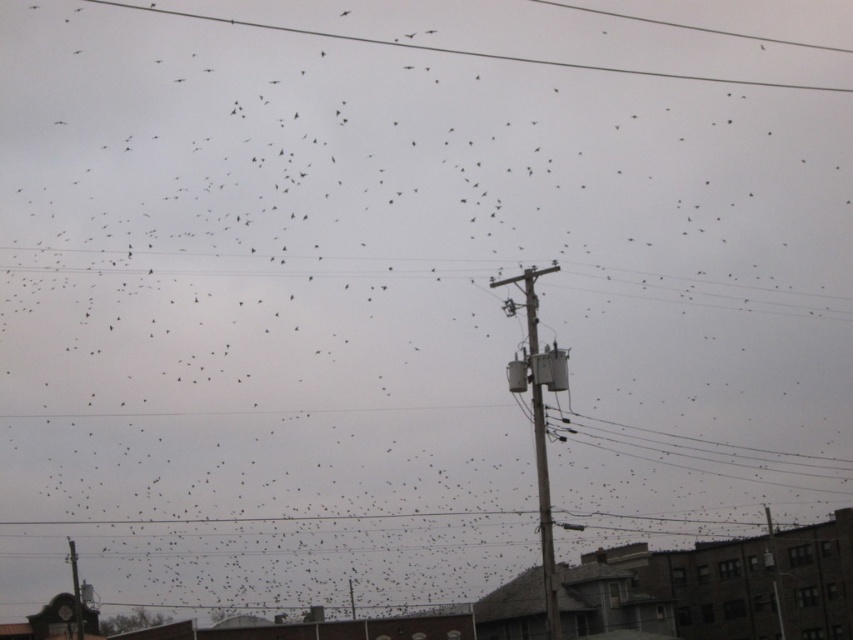
Is wooden utility pole at center wider than smooth wire at upper center?

In fact, wooden utility pole at center might be narrower than smooth wire at upper center.

Between wooden utility pole at center and smooth wire at upper center, which one has less height?

smooth wire at upper center

Describe the element at coordinates (537, 429) in the screenshot. I see `wooden utility pole at center` at that location.

You are a GUI agent. You are given a task and a screenshot of the screen. Output one action in this format:
    pyautogui.click(x=<x>, y=<y>)
    Task: Click on the wooden utility pole at center
    The width and height of the screenshot is (853, 640).
    Given the screenshot: What is the action you would take?
    pyautogui.click(x=537, y=429)